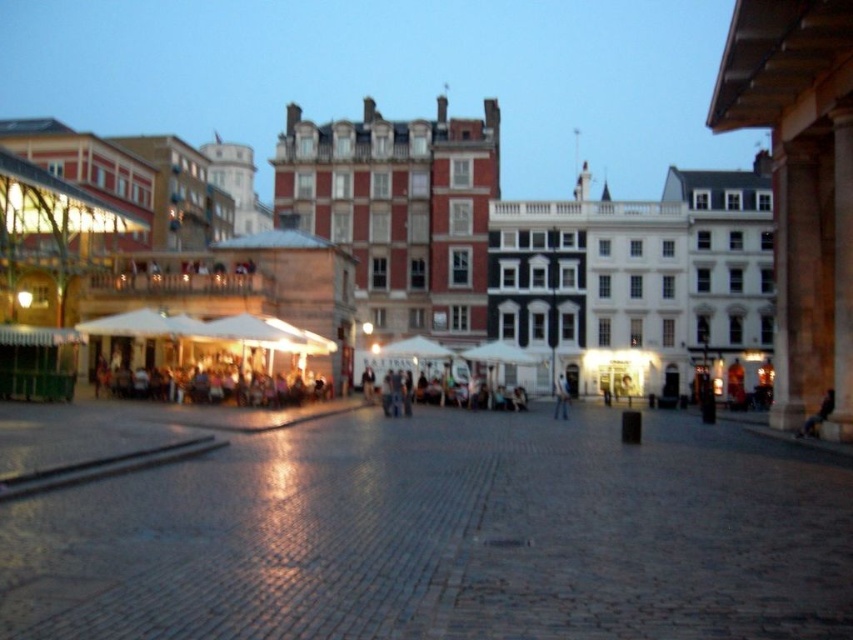
You are a delivery person trying to navigate through the urban square. You see the white matte building at center and the light blue jeans at center. Which object is wider, allowing you to pass through more easily?

The white matte building at center might be wider than light blue jeans at center, so it could allow you to pass through more easily.